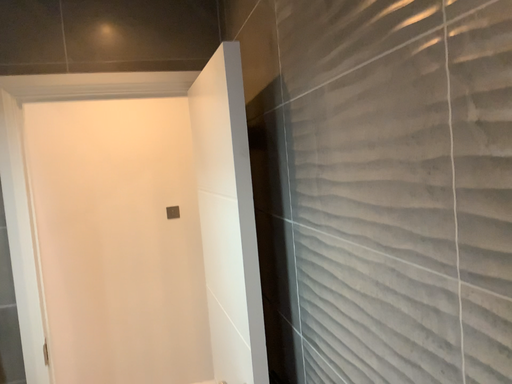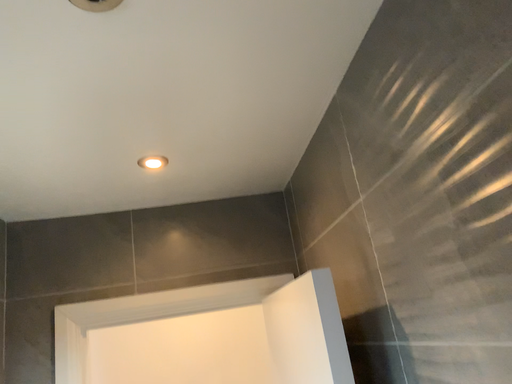
Question: How did the camera likely rotate when shooting the video?

Choices:
 (A) rotated left
 (B) rotated right

Answer: (A)